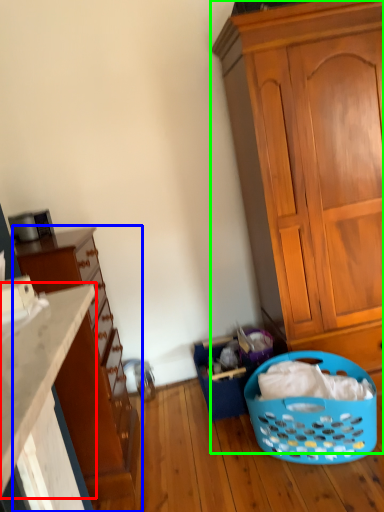
Question: Considering the real-world distances, which object is farthest from countertop (highlighted by a red box)? cupboard (highlighted by a blue box) or cabinetry (highlighted by a green box)?

Choices:
 (A) cupboard
 (B) cabinetry

Answer: (B)